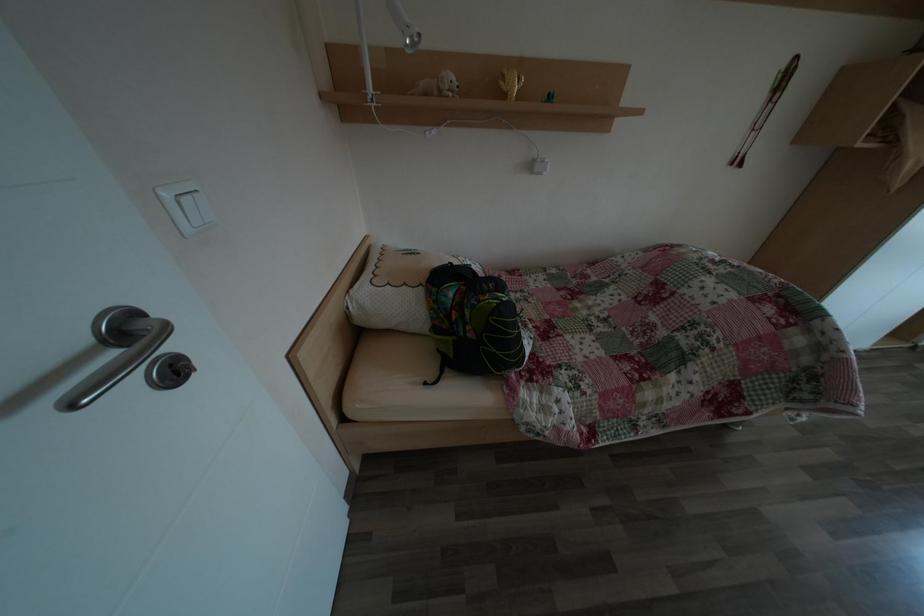
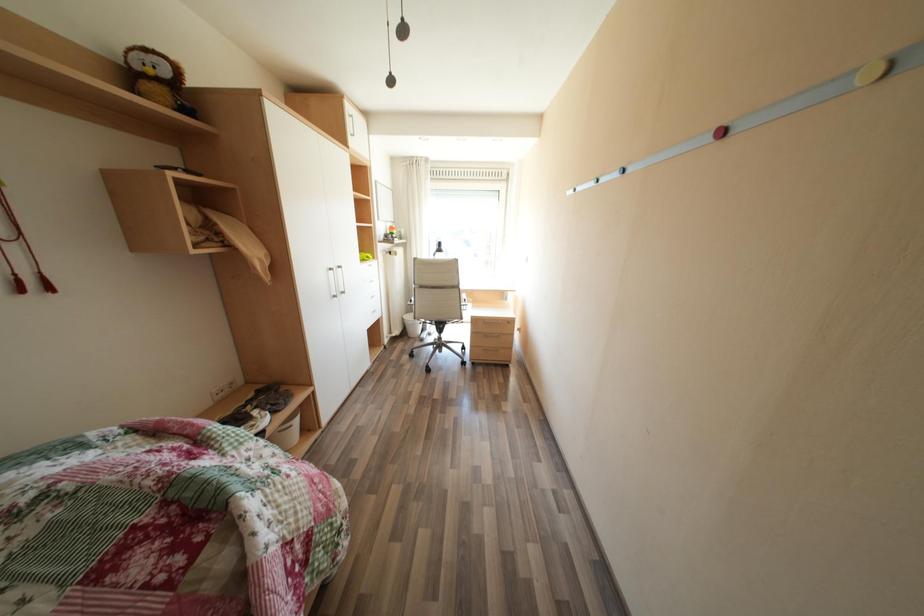
Question: Based on the continuous images, in which direction is the camera rotating? Reply with the corresponding letter.

Choices:
 (A) Left
 (B) Right
 (C) Up
 (D) Down

Answer: (B)